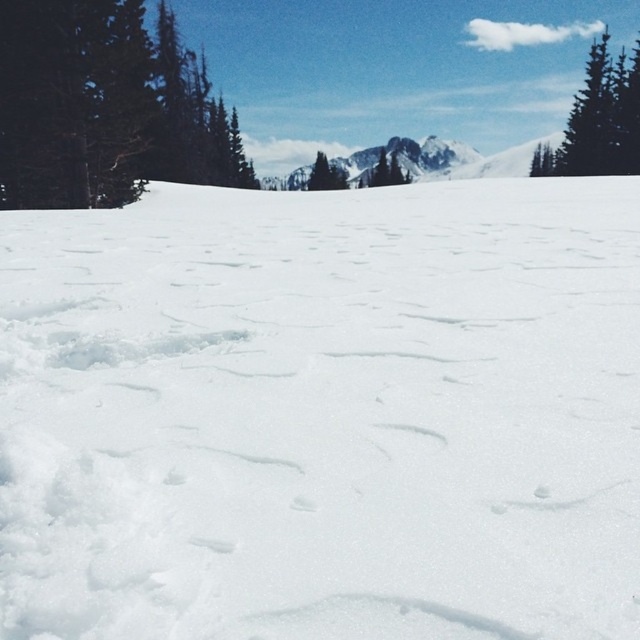
You are an outdoor photographer planning to capture a landscape photo that includes both the green matte tree at upper left and the rocky gray mountain at center. Based on their sizes in the image, which object should you focus on first to ensure it appears prominent in the final shot?

The rocky gray mountain at center is larger than the green matte tree at upper left, so you should focus on the rocky gray mountain at center first to ensure it appears prominent in the final shot.